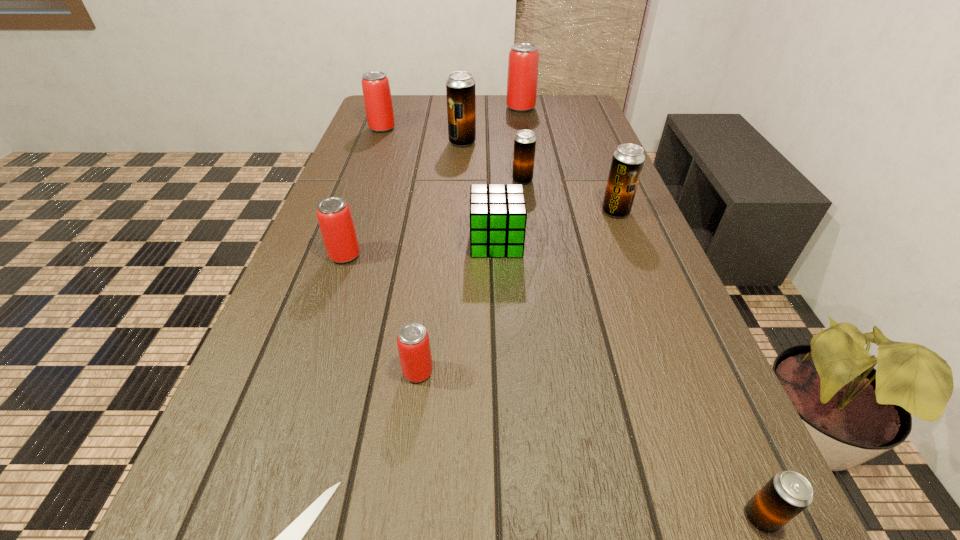
Where is `vacant region located 0.100m on the left of the fifth farthest beer can`? The width and height of the screenshot is (960, 540). vacant region located 0.100m on the left of the fifth farthest beer can is located at coordinates (560, 212).

Locate an element on the screen. vacant space situated 0.400m on the right of the third biggest pink beer can is located at coordinates (546, 255).

Identify the location of vacant space located on the left of the third black beer can from right to left. This screenshot has width=960, height=540. (389, 180).

Where is `vacant space situated on the front of the cube`? Image resolution: width=960 pixels, height=540 pixels. vacant space situated on the front of the cube is located at coordinates (499, 310).

You are a GUI agent. You are given a task and a screenshot of the screen. Output one action in this format:
    pyautogui.click(x=<x>, y=<y>)
    Task: Click on the free spot located 0.400m on the back of the nearest pink beer can
    This screenshot has width=960, height=540.
    Given the screenshot: What is the action you would take?
    pos(437,221)

Identify the location of vacant area situated on the back of the nearest beer can. (690, 354).

Locate an element on the screen. This screenshot has width=960, height=540. object that is at the far left corner is located at coordinates (375, 85).

Where is `vacant space at the left edge of the desktop`? The height and width of the screenshot is (540, 960). vacant space at the left edge of the desktop is located at coordinates (339, 364).

The height and width of the screenshot is (540, 960). In the image, there is a desktop. In order to click on blank space at the right edge in this screenshot , I will do `click(646, 277)`.

Where is `vacant area that lies between the biggest pink beer can and the biggest black beer can`? This screenshot has height=540, width=960. vacant area that lies between the biggest pink beer can and the biggest black beer can is located at coordinates (492, 125).